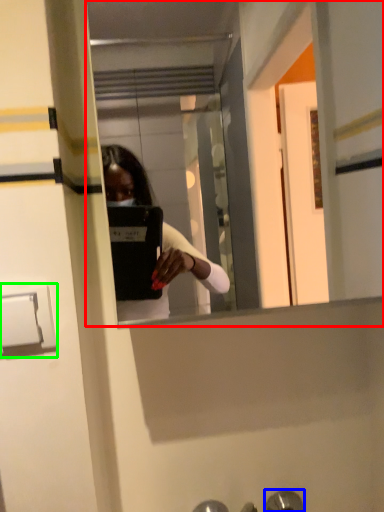
Question: Which is farther away from mirror (highlighted by a red box)? door handle (highlighted by a blue box) or door handle (highlighted by a green box)?

Choices:
 (A) door handle
 (B) door handle

Answer: (B)